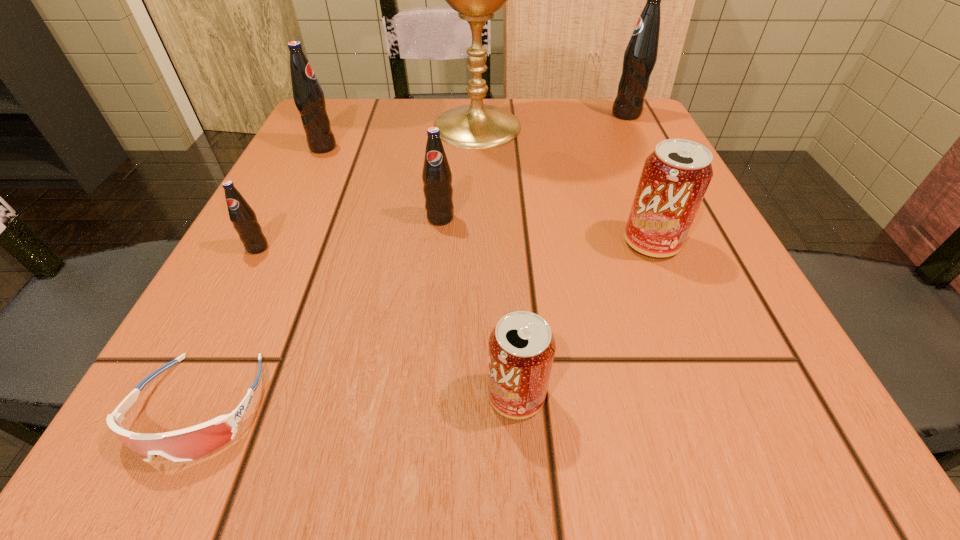
What are the coordinates of `free space at the far edge of the desktop` in the screenshot? It's located at (452, 107).

I want to click on vacant space at the left edge of the desktop, so click(x=283, y=365).

In the image, there is a desktop. Where is `blank space at the right edge`? This screenshot has height=540, width=960. blank space at the right edge is located at coordinates (713, 346).

You are a GUI agent. You are given a task and a screenshot of the screen. Output one action in this format:
    pyautogui.click(x=<x>, y=<y>)
    Task: Click on the free space at the far right corner of the desktop
    The height and width of the screenshot is (540, 960).
    Given the screenshot: What is the action you would take?
    pyautogui.click(x=599, y=98)

Locate an element on the screen. The width and height of the screenshot is (960, 540). empty space that is in between the nearer red soda can and the goggles is located at coordinates (358, 401).

I want to click on free space between the nearest soda can and the tallest object, so click(x=496, y=261).

Locate an element on the screen. The height and width of the screenshot is (540, 960). free spot between the goggles and the bigger red soda can is located at coordinates (425, 325).

The image size is (960, 540). Find the location of `blank region between the tallest object and the nearest black pop`. blank region between the tallest object and the nearest black pop is located at coordinates (368, 187).

The image size is (960, 540). In order to click on free spot between the tallest object and the bigger red soda can in this screenshot , I will do `click(564, 185)`.

The height and width of the screenshot is (540, 960). Identify the location of vacant space that is in between the trophy cup and the tallest soda can. click(552, 120).